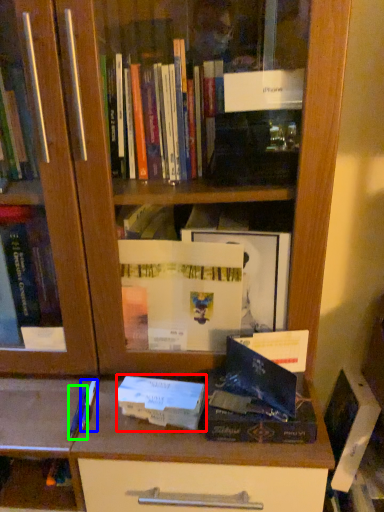
Question: Based on their relative distances, which object is farther from paperback book (highlighted by a red box)? Choose from pen (highlighted by a blue box) and pen (highlighted by a green box).

Choices:
 (A) pen
 (B) pen

Answer: (B)